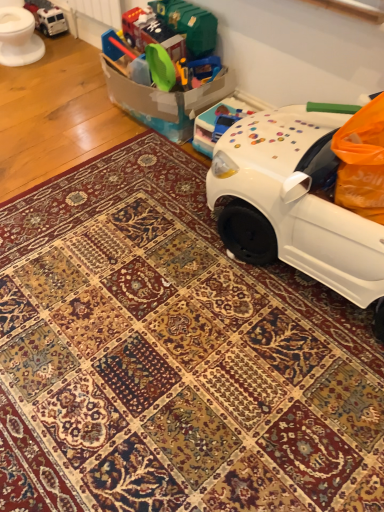
Question: From the image's perspective, is metallic silver truck at upper left, which is counted as the 2th toy, starting from the right, over translucent plastic toy car at upper right, which is the 1th toy in bottom-to-top order?

Choices:
 (A) yes
 (B) no

Answer: (A)

Question: Does metallic silver truck at upper left, which is counted as the 2th toy, starting from the right, have a lesser height compared to translucent plastic toy car at upper right, arranged as the first toy when viewed from the right?

Choices:
 (A) no
 (B) yes

Answer: (B)

Question: Is metallic silver truck at upper left, which appears as the first toy when viewed from the left, not near translucent plastic toy car at upper right, acting as the 2th toy starting from the top?

Choices:
 (A) yes
 (B) no

Answer: (A)

Question: Considering the relative sizes of metallic silver truck at upper left, arranged as the 1th toy when viewed from the top, and translucent plastic toy car at upper right, arranged as the first toy when viewed from the right, in the image provided, is metallic silver truck at upper left, arranged as the 1th toy when viewed from the top, thinner than translucent plastic toy car at upper right, arranged as the first toy when viewed from the right,?

Choices:
 (A) yes
 (B) no

Answer: (A)

Question: Is metallic silver truck at upper left, which appears as the first toy when viewed from the left, directly adjacent to translucent plastic toy car at upper right, which is the 1th toy in bottom-to-top order?

Choices:
 (A) yes
 (B) no

Answer: (B)

Question: In terms of size, does white glossy toilet bowl at upper left appear bigger or smaller than metallic silver truck at upper left, arranged as the 1th toy when viewed from the top?

Choices:
 (A) big
 (B) small

Answer: (A)

Question: From a real-world perspective, is white glossy toilet bowl at upper left above or below metallic silver truck at upper left, which is counted as the 2th toy, starting from the front?

Choices:
 (A) above
 (B) below

Answer: (A)

Question: Is white glossy toilet bowl at upper left to the left or to the right of metallic silver truck at upper left, arranged as the 1th toy when viewed from the top, in the image?

Choices:
 (A) right
 (B) left

Answer: (B)

Question: Does point (13, 36) appear closer or farther from the camera than point (56, 15)?

Choices:
 (A) closer
 (B) farther

Answer: (A)

Question: Is white glossy toilet bowl at upper left inside the boundaries of translucent plastic toy car at upper right, which is the 1th toy in bottom-to-top order, or outside?

Choices:
 (A) inside
 (B) outside

Answer: (B)

Question: In terms of height, does white glossy toilet bowl at upper left look taller or shorter compared to translucent plastic toy car at upper right, acting as the 2th toy starting from the top?

Choices:
 (A) tall
 (B) short

Answer: (A)

Question: From the image's perspective, is white glossy toilet bowl at upper left above or below translucent plastic toy car at upper right, acting as the 2th toy starting from the top?

Choices:
 (A) below
 (B) above

Answer: (B)

Question: Looking at the image, does white glossy toilet bowl at upper left seem bigger or smaller compared to translucent plastic toy car at upper right, the 2th toy viewed from the back?

Choices:
 (A) big
 (B) small

Answer: (A)

Question: Considering the positions of translucent plastic toy car at upper right, which is the 1th toy in front-to-back order, and metallic silver truck at upper left, placed as the second toy when sorted from bottom to top, in the image, is translucent plastic toy car at upper right, which is the 1th toy in front-to-back order, wider or thinner than metallic silver truck at upper left, placed as the second toy when sorted from bottom to top,?

Choices:
 (A) wide
 (B) thin

Answer: (A)

Question: In terms of size, does translucent plastic toy car at upper right, the 2th toy viewed from the back, appear bigger or smaller than metallic silver truck at upper left, arranged as the 1th toy when viewed from the top?

Choices:
 (A) small
 (B) big

Answer: (B)